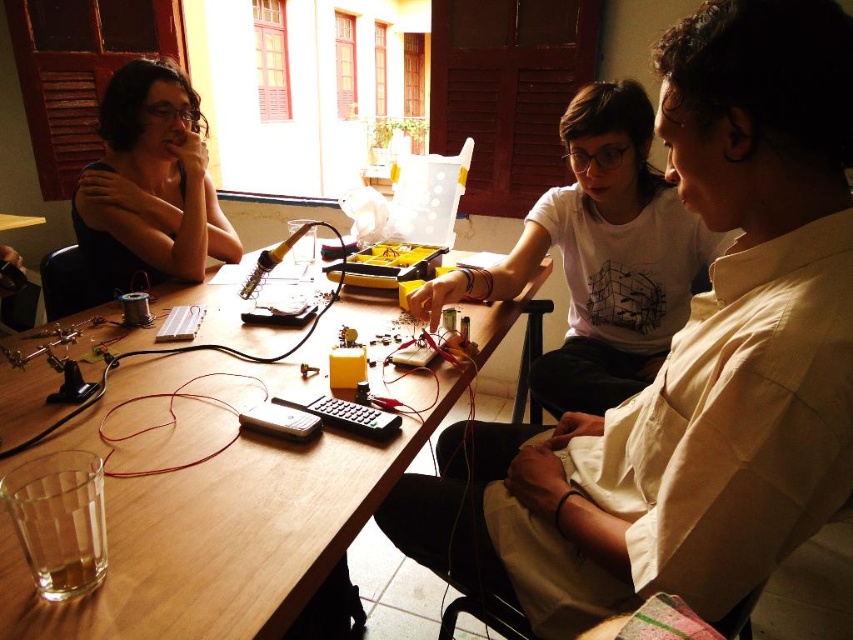
You are a photographer trying to capture a candid shot of the two people wearing white matte shirt at upper center and matte black shirt at left. Since you want to ensure both are in the frame, which direction should you position your camera relative to the group?

The white matte shirt at upper center is located below the matte black shirt at left, so positioning the camera above the group would allow both shirts to be visible in the frame.

Where is the white matte shirt at upper center located in the image?

The white matte shirt at upper center is located at point (688, 364) in the image.